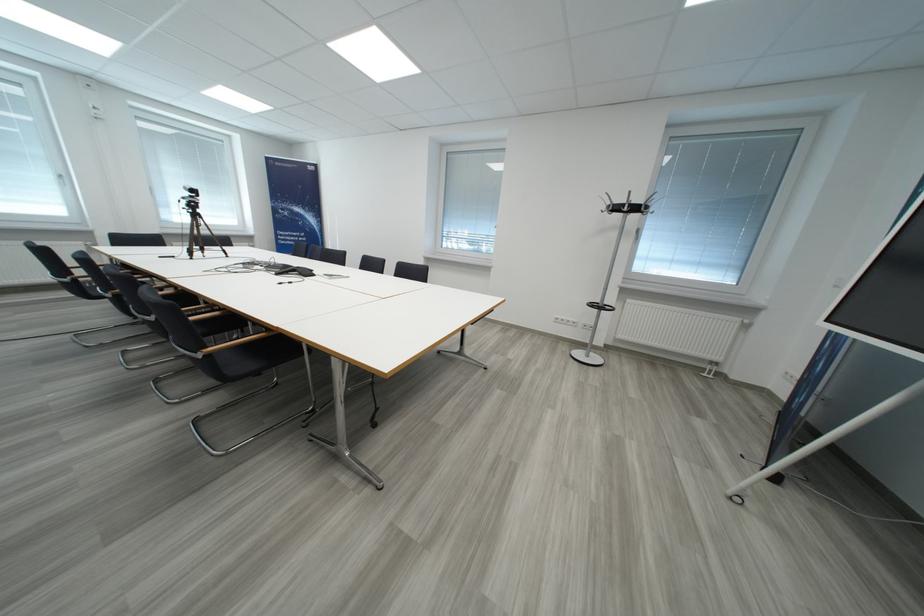
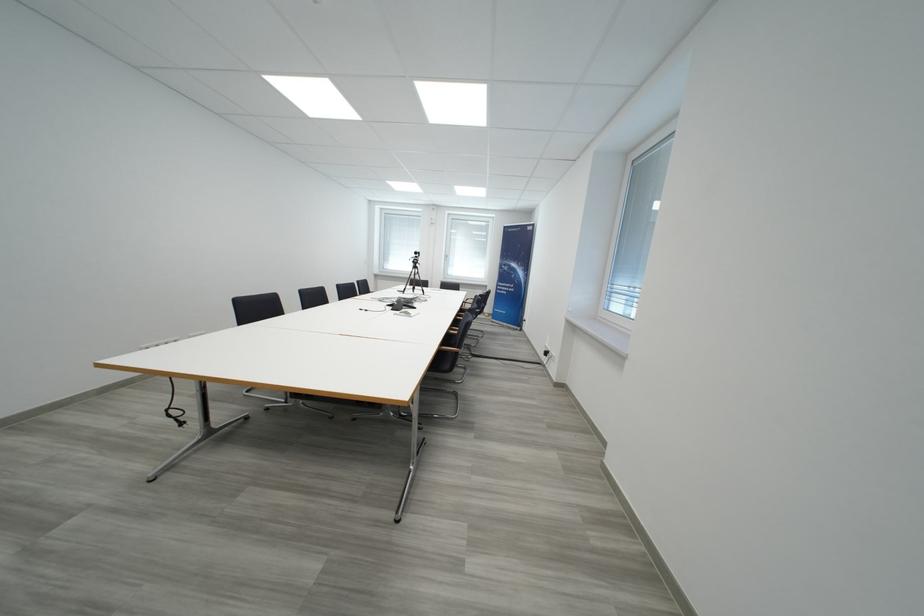
Where in the second image is the point corresponding to (210,252) from the first image?

(420, 291)